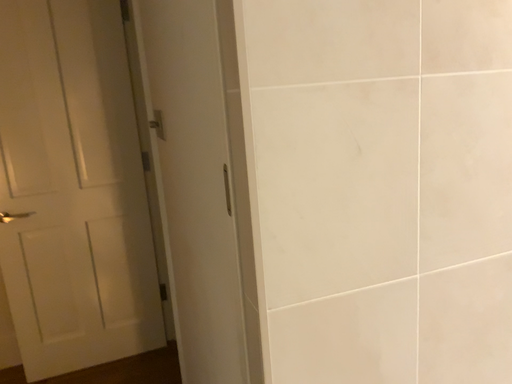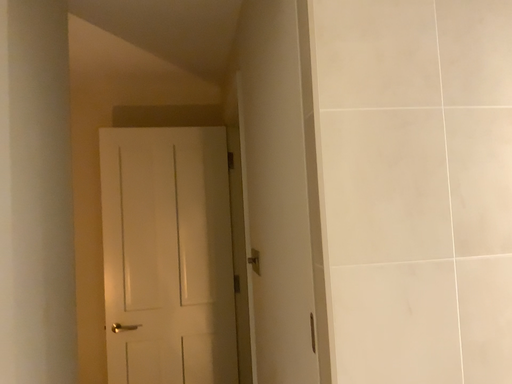
Question: How did the camera likely rotate when shooting the video?

Choices:
 (A) rotated left
 (B) rotated right

Answer: (A)